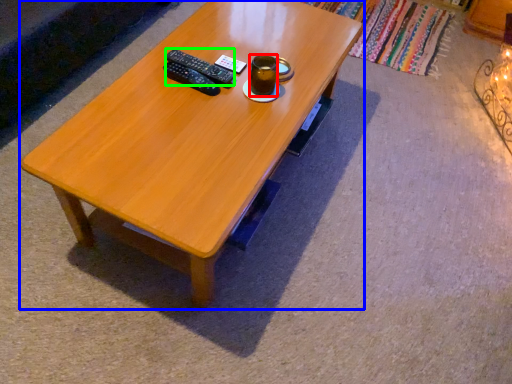
Question: Considering the real-world distances, which object is farthest from beverage (highlighted by a red box)? coffee table (highlighted by a blue box) or remote (highlighted by a green box)?

Choices:
 (A) coffee table
 (B) remote

Answer: (A)